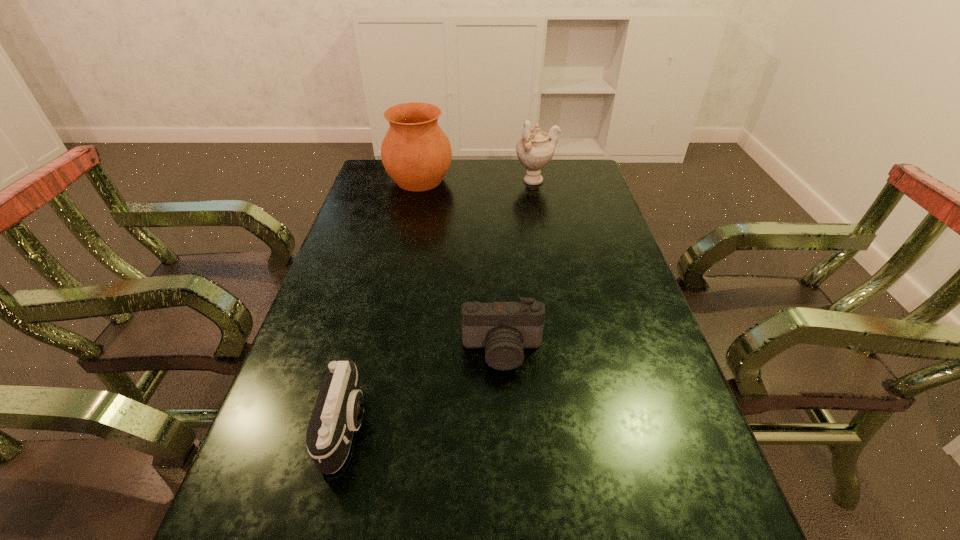
You are a GUI agent. You are given a task and a screenshot of the screen. Output one action in this format:
    pyautogui.click(x=<x>, y=<y>)
    Task: Click on the vacant space at the far right corner of the desktop
    The height and width of the screenshot is (540, 960).
    Given the screenshot: What is the action you would take?
    pyautogui.click(x=555, y=165)

I want to click on free space between the urn and the pottery, so click(477, 180).

The image size is (960, 540). Find the location of `empty space between the left camera and the pottery`. empty space between the left camera and the pottery is located at coordinates (383, 303).

At what (x,y) coordinates should I click in order to perform the action: click on empty space between the nearer camera and the third farthest object. Please return your answer as a coordinate pair (x, y). This screenshot has width=960, height=540. Looking at the image, I should click on (424, 389).

This screenshot has width=960, height=540. I want to click on vacant space that's between the third shortest object and the pottery, so click(x=477, y=180).

At what (x,y) coordinates should I click in order to perform the action: click on vacant space in between the third shortest object and the pottery. Please return your answer as a coordinate pair (x, y). Image resolution: width=960 pixels, height=540 pixels. Looking at the image, I should click on (477, 180).

Where is `free space that is in between the right camera and the nearest object`? free space that is in between the right camera and the nearest object is located at coordinates (424, 389).

You are a GUI agent. You are given a task and a screenshot of the screen. Output one action in this format:
    pyautogui.click(x=<x>, y=<y>)
    Task: Click on the vacant space in between the left camera and the farther camera
    The height and width of the screenshot is (540, 960).
    Given the screenshot: What is the action you would take?
    pyautogui.click(x=424, y=389)

Where is `free space between the second tallest object and the pottery`? The width and height of the screenshot is (960, 540). free space between the second tallest object and the pottery is located at coordinates (477, 180).

Identify the location of vacant area that lies between the right camera and the nearest object. The width and height of the screenshot is (960, 540). (424, 389).